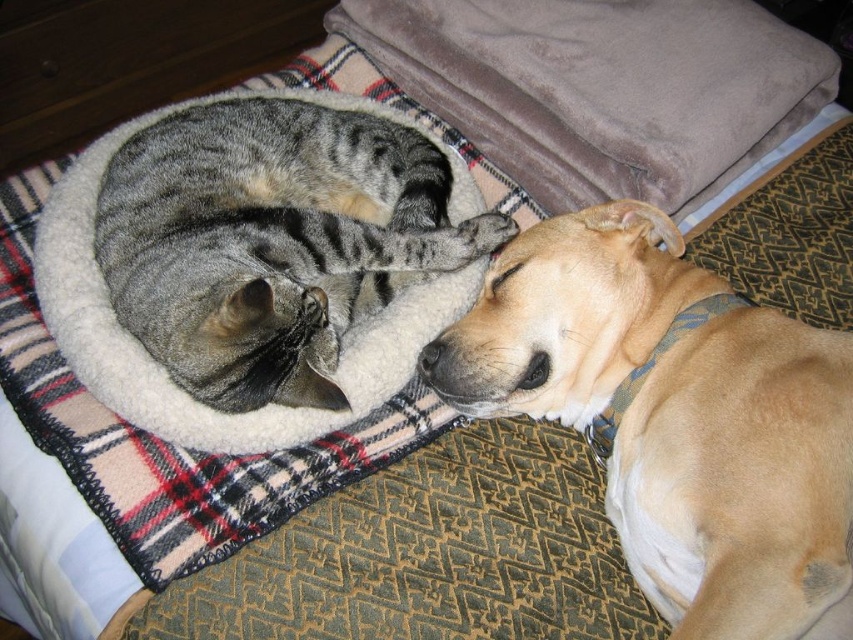
Question: Is light brown fur at lower right above gray striped cat at left?

Choices:
 (A) yes
 (B) no

Answer: (B)

Question: Does light brown fur at lower right have a lesser width compared to gray striped cat at left?

Choices:
 (A) yes
 (B) no

Answer: (A)

Question: Which of the following is the farthest from the observer?

Choices:
 (A) light brown fur at lower right
 (B) gray striped cat at left

Answer: (B)

Question: Does light brown fur at lower right have a greater width compared to gray striped cat at left?

Choices:
 (A) no
 (B) yes

Answer: (A)

Question: Among these objects, which one is nearest to the camera?

Choices:
 (A) gray striped cat at left
 (B) light brown fur at lower right

Answer: (B)

Question: Which object is closer to the camera taking this photo?

Choices:
 (A) light brown fur at lower right
 (B) gray striped cat at left

Answer: (A)